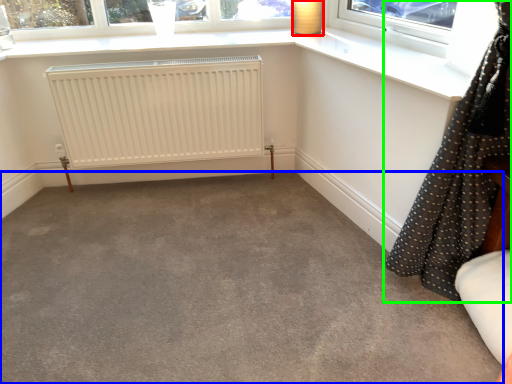
Question: Estimate the real-world distances between objects in this image. Which object is farther from lamp (highlighted by a red box), concrete (highlighted by a blue box) or curtain (highlighted by a green box)?

Choices:
 (A) concrete
 (B) curtain

Answer: (A)